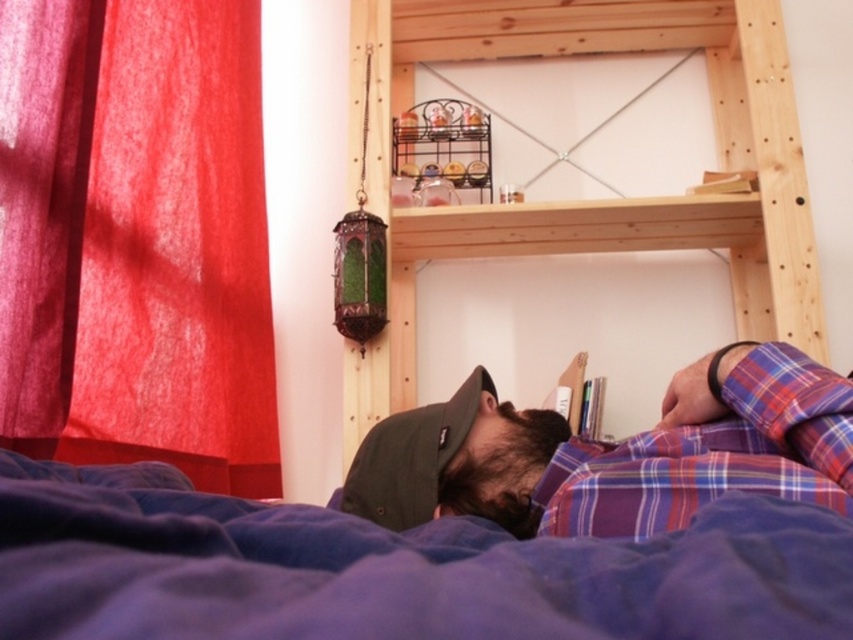
Does blue soft blanket at lower center have a smaller size compared to green fabric cap at center?

No.

Describe the element at coordinates (392, 568) in the screenshot. I see `blue soft blanket at lower center` at that location.

Identify the location of blue soft blanket at lower center. (392, 568).

Does red fabric curtain at left have a greater height compared to green fabric cap at center?

Indeed, red fabric curtain at left has a greater height compared to green fabric cap at center.

Which of these two, red fabric curtain at left or green fabric cap at center, stands taller?

With more height is red fabric curtain at left.

This screenshot has height=640, width=853. I want to click on red fabric curtain at left, so click(x=136, y=237).

Does wooden bunk bed at upper center appear on the right side of plaid fabric shirt at lower center?

Yes, wooden bunk bed at upper center is to the right of plaid fabric shirt at lower center.

Does wooden bunk bed at upper center come in front of plaid fabric shirt at lower center?

No, it is not.

Is point (714, 90) less distant than point (659, 468)?

No, it is not.

You are a GUI agent. You are given a task and a screenshot of the screen. Output one action in this format:
    pyautogui.click(x=<x>, y=<y>)
    Task: Click on the wooden bunk bed at upper center
    This screenshot has width=853, height=640.
    Given the screenshot: What is the action you would take?
    pyautogui.click(x=596, y=200)